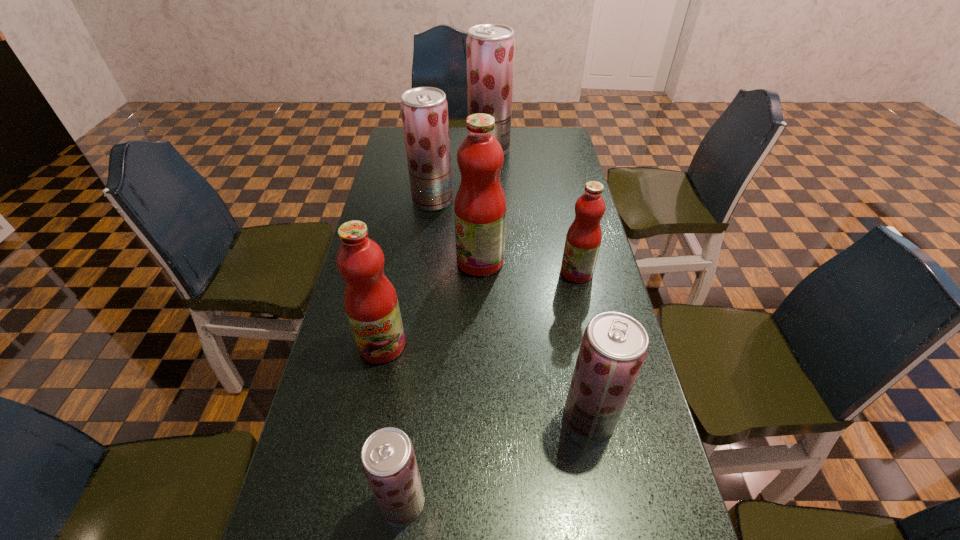
The image size is (960, 540). I want to click on the closest pink fruit juice to the smallest pink fruit juice, so click(480, 207).

At what (x,y) coordinates should I click in order to perform the action: click on vacant area in the image that satisfies the following two spatial constraints: 1. on the back side of the second smallest strawberry fruit juice; 2. on the front label of the second pink fruit juice from left to right. Please return your answer as a coordinate pair (x, y). Image resolution: width=960 pixels, height=540 pixels. Looking at the image, I should click on (560, 261).

Locate an element on the screen. Image resolution: width=960 pixels, height=540 pixels. vacant space that satisfies the following two spatial constraints: 1. on the front label of the second pink fruit juice from right to left; 2. on the front label of the nearest pink fruit juice is located at coordinates (480, 345).

Image resolution: width=960 pixels, height=540 pixels. What are the coordinates of `free spot that satisfies the following two spatial constraints: 1. on the front label of the third farthest strawberry fruit juice; 2. on the right side of the second smallest pink fruit juice` in the screenshot? It's located at (368, 418).